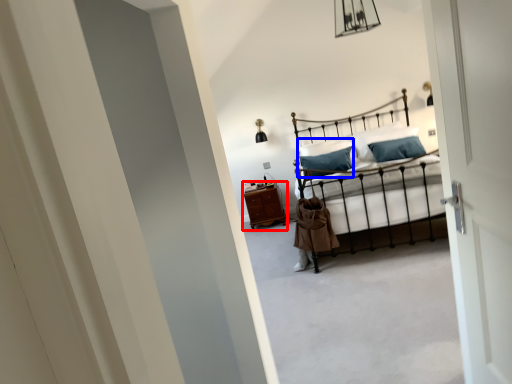
Question: Which object appears farthest to the camera in this image, nightstand (highlighted by a red box) or pillow (highlighted by a blue box)?

Choices:
 (A) nightstand
 (B) pillow

Answer: (A)